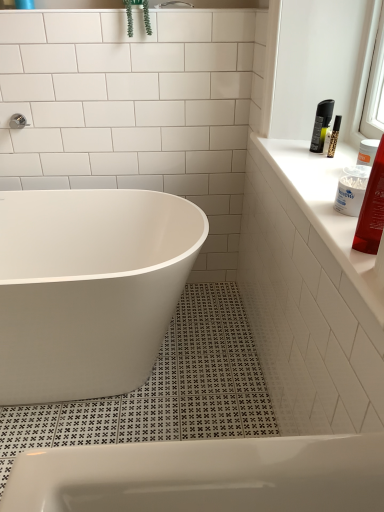
Find the location of a particular element. vacant space situated on the left part of white plastic cotton swab container at upper right is located at coordinates (324, 206).